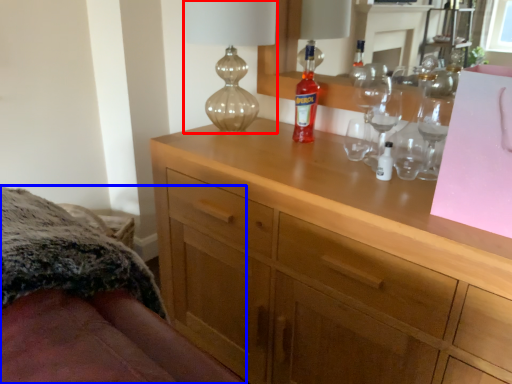
Question: Which object appears farthest to the camera in this image, table lamp (highlighted by a red box) or bed (highlighted by a blue box)?

Choices:
 (A) table lamp
 (B) bed

Answer: (A)